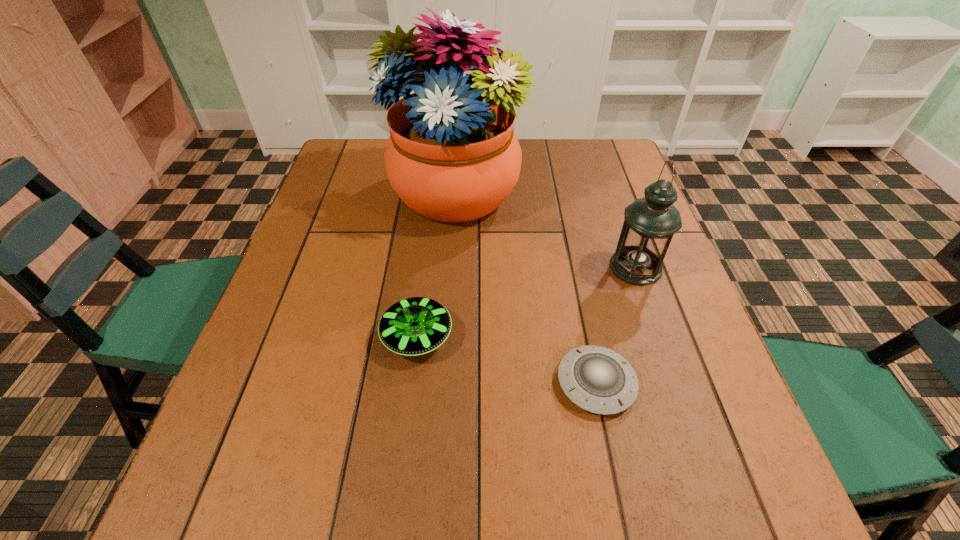
In the image, there is a desktop. Identify the location of vacant space at the near right corner. Image resolution: width=960 pixels, height=540 pixels. (726, 507).

The image size is (960, 540). Identify the location of free spot between the flower arrangement and the shorter saucer. (526, 289).

Locate an element on the screen. The width and height of the screenshot is (960, 540). free space between the left saucer and the flower arrangement is located at coordinates (436, 266).

At what (x,y) coordinates should I click in order to perform the action: click on vacant point located between the left saucer and the farthest object. Please return your answer as a coordinate pair (x, y). Looking at the image, I should click on (436, 266).

I want to click on free space between the shorter saucer and the second tallest object, so click(616, 325).

This screenshot has width=960, height=540. Find the location of `empty space that is in between the farthest object and the second tallest object`. empty space that is in between the farthest object and the second tallest object is located at coordinates (545, 232).

Where is `vacant area between the tallest object and the rightmost object`? The height and width of the screenshot is (540, 960). vacant area between the tallest object and the rightmost object is located at coordinates (545, 232).

You are a GUI agent. You are given a task and a screenshot of the screen. Output one action in this format:
    pyautogui.click(x=<x>, y=<y>)
    Task: Click on the free space between the third shortest object and the farthest object
    This screenshot has height=540, width=960.
    Given the screenshot: What is the action you would take?
    pyautogui.click(x=545, y=232)

You are a GUI agent. You are given a task and a screenshot of the screen. Output one action in this format:
    pyautogui.click(x=<x>, y=<y>)
    Task: Click on the vacant space that's between the shorter saucer and the taller saucer
    
    Given the screenshot: What is the action you would take?
    pyautogui.click(x=507, y=359)

Find the location of `vacant region between the third nearest object and the shortest object`. vacant region between the third nearest object and the shortest object is located at coordinates (616, 325).